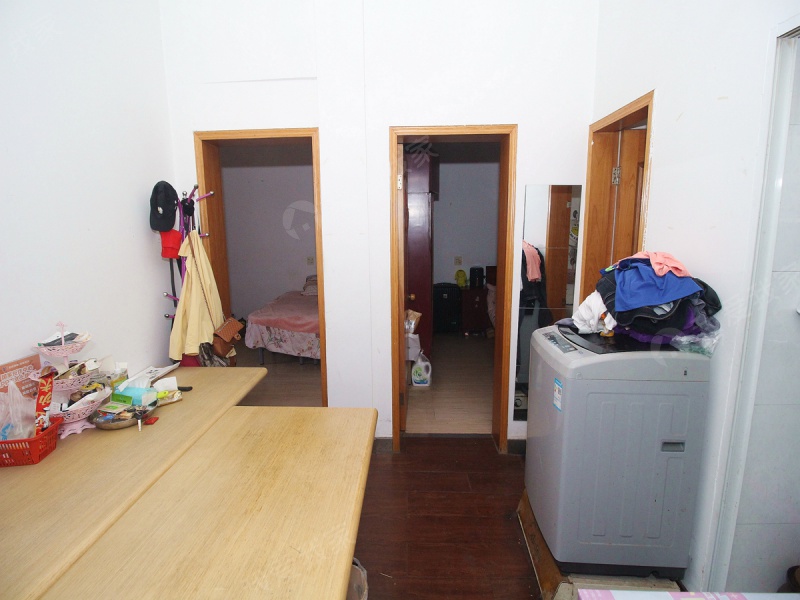
Locate an element on the screen. three doorways is located at coordinates pos(272,234), pos(454,220), pos(637,184).